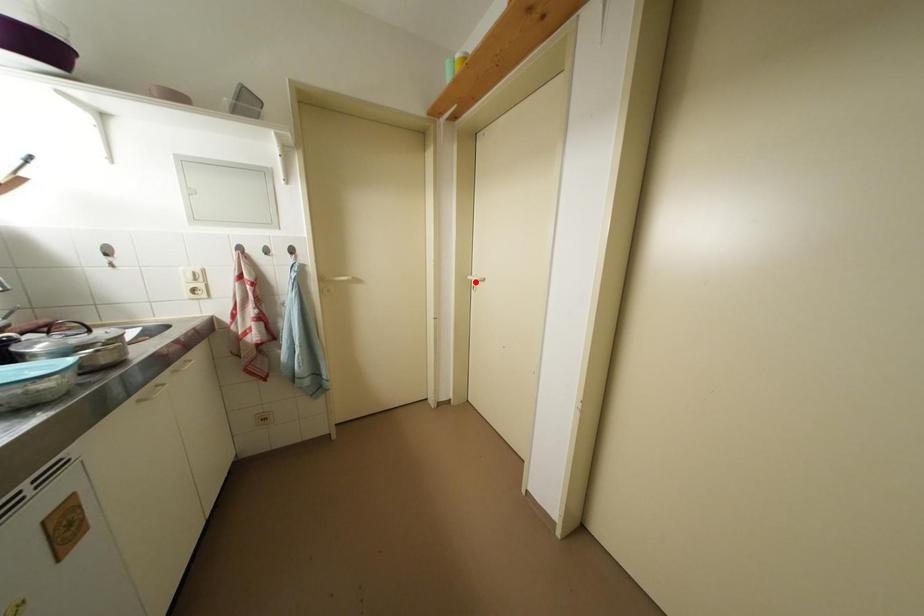
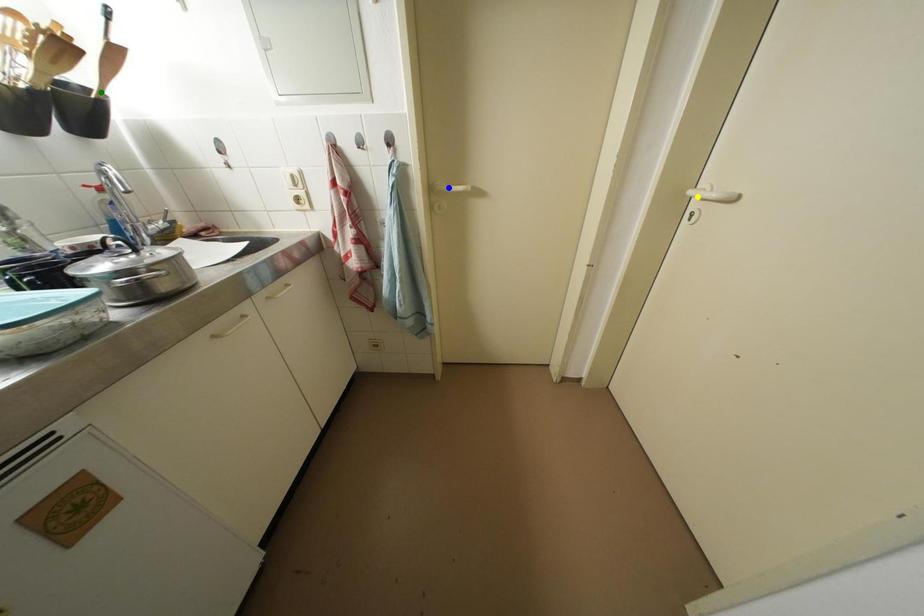
Question: I am providing you with two images of the same scene from different viewpoints. A red point is marked on the first image. You are given multiple points on the second image. In image 2, which mark is for the same physical point as the one in image 1?

Choices:
 (A) yellow point
 (B) green point
 (C) blue point

Answer: (A)